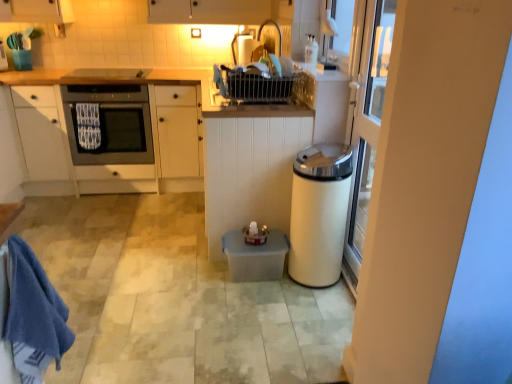
Question: From a real-world perspective, is matte black oven at left below white textured bath towel at left, which is counted as the 1th bath towel, starting from the top?

Choices:
 (A) no
 (B) yes

Answer: (B)

Question: Is matte black oven at left taller than white textured bath towel at left, the 2th bath towel ordered from the bottom?

Choices:
 (A) yes
 (B) no

Answer: (A)

Question: Could you tell me if matte black oven at left is facing white textured bath towel at left, which is counted as the 1th bath towel, starting from the top?

Choices:
 (A) yes
 (B) no

Answer: (A)

Question: Is white textured bath towel at left, which is counted as the 1th bath towel, starting from the top, at the back of matte black oven at left?

Choices:
 (A) no
 (B) yes

Answer: (A)

Question: Can you confirm if matte black oven at left is wider than white textured bath towel at left, which is counted as the 1th bath towel, starting from the top?

Choices:
 (A) no
 (B) yes

Answer: (B)

Question: Is matte black oven at left with white textured bath towel at left, which is counted as the 1th bath towel, starting from the top?

Choices:
 (A) no
 (B) yes

Answer: (A)

Question: From a real-world perspective, is translucent plastic container at center physically below white glossy trash can at right?

Choices:
 (A) no
 (B) yes

Answer: (B)

Question: Is white glossy trash can at right at the back of translucent plastic container at center?

Choices:
 (A) yes
 (B) no

Answer: (A)

Question: From the image's perspective, is translucent plastic container at center located beneath white glossy trash can at right?

Choices:
 (A) yes
 (B) no

Answer: (A)

Question: Can you confirm if translucent plastic container at center is thinner than white glossy trash can at right?

Choices:
 (A) yes
 (B) no

Answer: (B)

Question: Is white glossy trash can at right surrounded by translucent plastic container at center?

Choices:
 (A) yes
 (B) no

Answer: (B)

Question: Considering the relative sizes of translucent plastic container at center and white glossy trash can at right in the image provided, is translucent plastic container at center smaller than white glossy trash can at right?

Choices:
 (A) no
 (B) yes

Answer: (B)

Question: Are white matte cabinet at center, the 1th cabinetry viewed from the right, and white matte cabinet at left, positioned as the 2th cabinetry in right-to-left order, far apart?

Choices:
 (A) yes
 (B) no

Answer: (A)